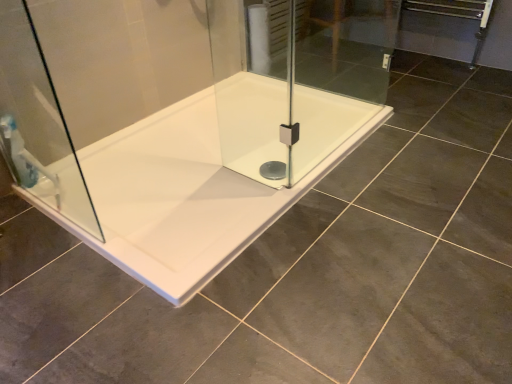
Question: Relative to transparent glass shower door at left, is white glossy bathtub at center in front or behind?

Choices:
 (A) front
 (B) behind

Answer: (B)

Question: From a real-world perspective, relative to transparent glass shower door at left, is white glossy bathtub at center vertically above or below?

Choices:
 (A) below
 (B) above

Answer: (A)

Question: Estimate the real-world distances between objects in this image. Which object is farther from the transparent glass shower door at left?

Choices:
 (A) translucent plastic shower at left
 (B) white glossy bathtub at center

Answer: (B)

Question: Which of these objects is positioned farthest from the translucent plastic shower at left?

Choices:
 (A) white glossy bathtub at center
 (B) transparent glass shower door at left

Answer: (A)